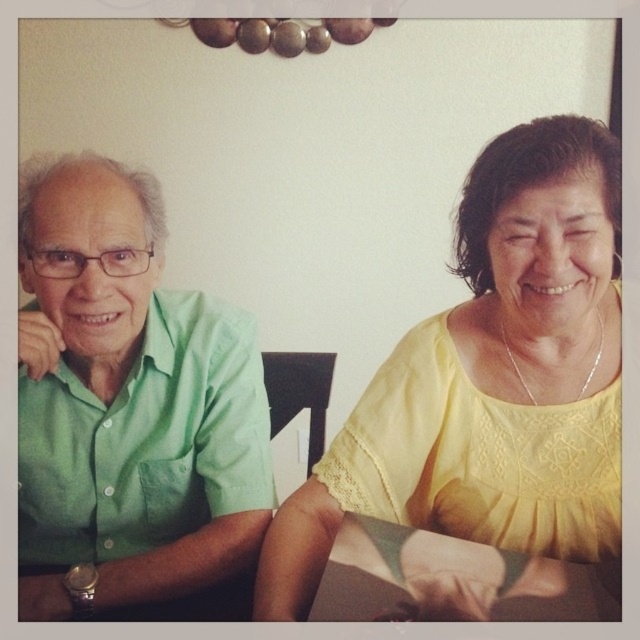
Question: Which object is the farthest from the yellow lace blouse at upper right?

Choices:
 (A) green matte shirt at left
 (B) wooden table at lower center

Answer: (A)

Question: Does yellow lace blouse at upper right come in front of wooden table at lower center?

Choices:
 (A) no
 (B) yes

Answer: (A)

Question: Observing the image, what is the correct spatial positioning of yellow lace blouse at upper right in reference to wooden table at lower center?

Choices:
 (A) below
 (B) above

Answer: (B)

Question: Which point is farther to the camera?

Choices:
 (A) (74, 337)
 (B) (422, 536)

Answer: (A)

Question: Does yellow lace blouse at upper right appear under green matte shirt at left?

Choices:
 (A) no
 (B) yes

Answer: (B)

Question: Considering the real-world distances, which object is closest to the yellow lace blouse at upper right?

Choices:
 (A) wooden table at lower center
 (B) green matte shirt at left

Answer: (A)